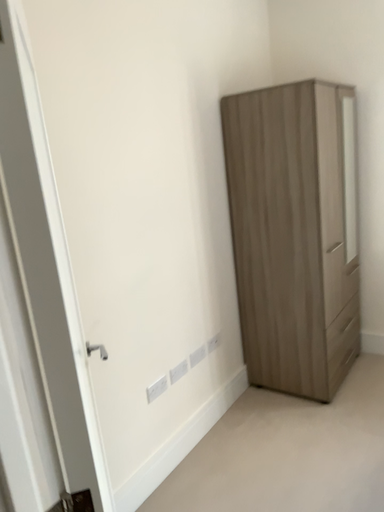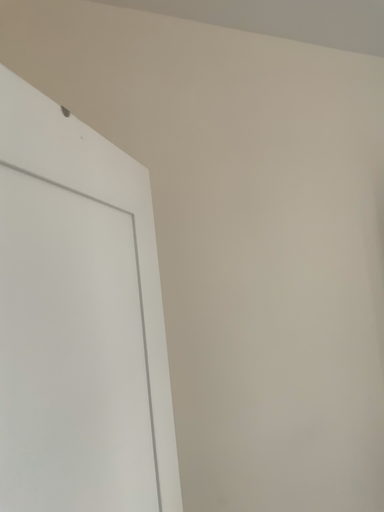
Question: Which way did the camera rotate in the video?

Choices:
 (A) rotated downward
 (B) rotated upward

Answer: (B)